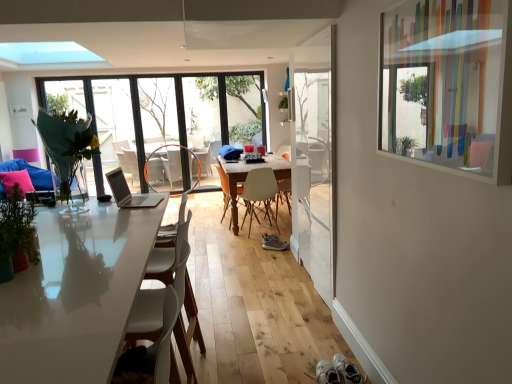
Question: In which direction should I rotate to look at beige plastic chair at center, the 2th chair positioned from the front?

Choices:
 (A) right
 (B) left

Answer: (A)

Question: Is the surface of green matte plant at left, the 2th plant from the back, in direct contact with tan suede sneaker at center?

Choices:
 (A) no
 (B) yes

Answer: (A)

Question: Considering the relative positions of green matte plant at left, which appears as the 2th plant when viewed from the top, and tan suede sneaker at center in the image provided, is green matte plant at left, which appears as the 2th plant when viewed from the top, to the left of tan suede sneaker at center from the viewer's perspective?

Choices:
 (A) yes
 (B) no

Answer: (A)

Question: Is green matte plant at left, which appears as the 2th plant when viewed from the top, taller than tan suede sneaker at center?

Choices:
 (A) yes
 (B) no

Answer: (A)

Question: Considering the relative sizes of green matte plant at left, the 2th plant in the right-to-left sequence, and tan suede sneaker at center in the image provided, is green matte plant at left, the 2th plant in the right-to-left sequence, bigger than tan suede sneaker at center?

Choices:
 (A) no
 (B) yes

Answer: (B)

Question: Does green matte plant at left, the first plant from the left, have a smaller size compared to tan suede sneaker at center?

Choices:
 (A) yes
 (B) no

Answer: (B)

Question: From a real-world perspective, is green matte plant at left, the 2th plant in the right-to-left sequence, beneath tan suede sneaker at center?

Choices:
 (A) no
 (B) yes

Answer: (A)

Question: Does white plastic chair at center, positioned as the first chair in front-to-back order, come behind transparent glass window at upper center?

Choices:
 (A) yes
 (B) no

Answer: (B)

Question: Is white plastic chair at center, the 3th chair when ordered from back to front, with transparent glass window at upper center?

Choices:
 (A) yes
 (B) no

Answer: (B)

Question: From the image's perspective, is white plastic chair at center, positioned as the first chair in front-to-back order, beneath transparent glass window at upper center?

Choices:
 (A) no
 (B) yes

Answer: (B)

Question: Does white plastic chair at center, the 3th chair when ordered from back to front, appear on the left side of transparent glass window at upper center?

Choices:
 (A) no
 (B) yes

Answer: (A)

Question: Is white plastic chair at center, the 3th chair when ordered from back to front, in front of transparent glass window at upper center?

Choices:
 (A) yes
 (B) no

Answer: (A)

Question: Is white plastic chair at center, positioned as the first chair in front-to-back order, oriented towards transparent glass window at upper center?

Choices:
 (A) yes
 (B) no

Answer: (B)

Question: From a real-world perspective, is matte orange armchair at center positioned over green matte plant at left, which is counted as the 1th plant, starting from the bottom, based on gravity?

Choices:
 (A) yes
 (B) no

Answer: (B)